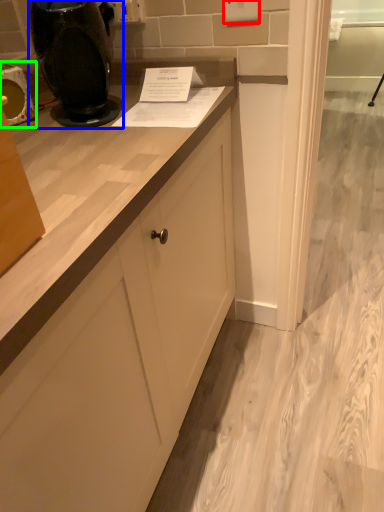
Question: Which object is positioned farthest from electric outlet (highlighted by a red box)? Select from home appliance (highlighted by a blue box) and appliance (highlighted by a green box).

Choices:
 (A) home appliance
 (B) appliance

Answer: (B)